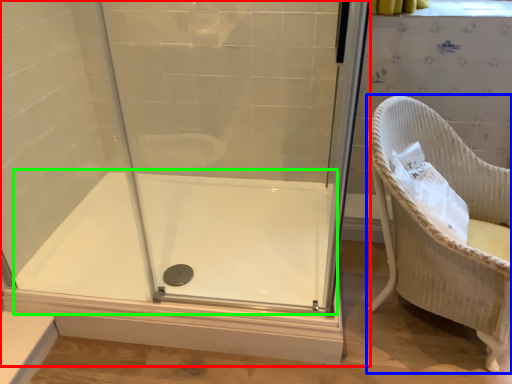
Question: Which object is the farthest from shower door (highlighted by a red box)? Choose among these: furniture (highlighted by a blue box) or bath (highlighted by a green box).

Choices:
 (A) furniture
 (B) bath

Answer: (A)